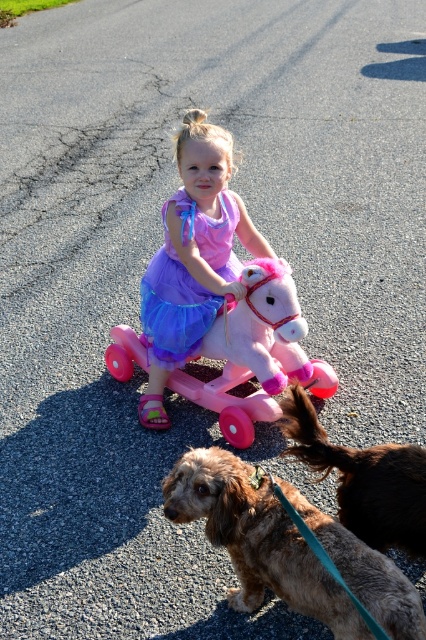
You are standing at point (198, 464) and want to take a photo of the scene. The camera is 2.20 meters away from you. Can you reach the camera to take the photo if your maximum reach is 2.0 meters?

The distance between you at point (198, 464) and the camera is 2.20 meters, which exceeds your maximum reach of 2.0 meters. Therefore, you cannot reach the camera to take the photo.

The young girl is wearing a pink satin dress at center and sitting on a pastel pink plastic horse at center. Which object is closer to the camera?

The pink satin dress at center is closer to the camera because the pastel pink plastic horse at center is behind it.